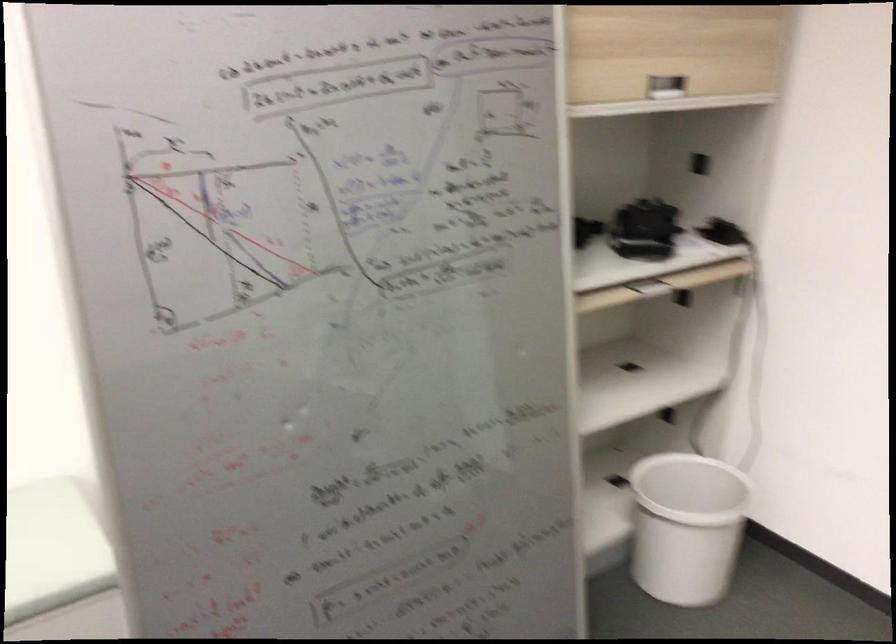
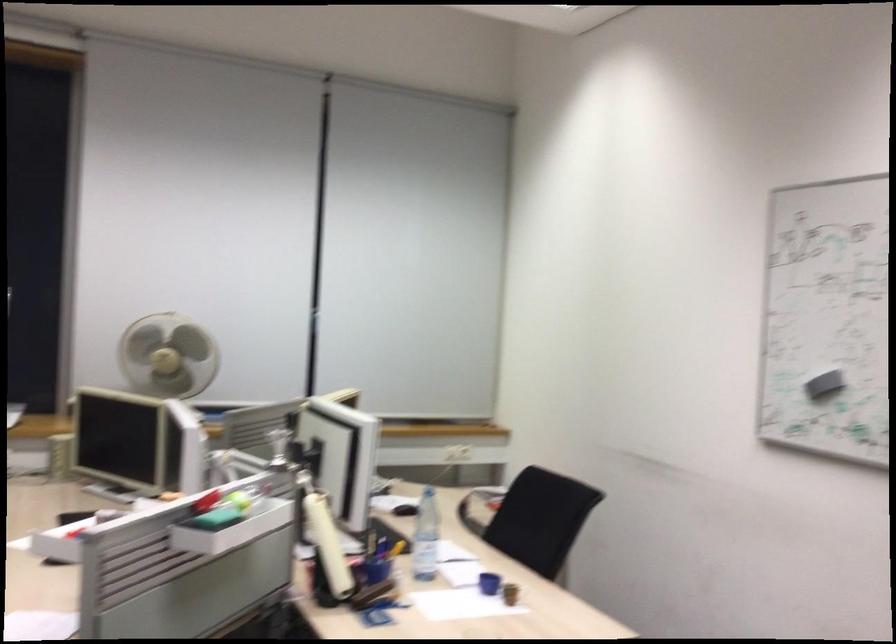
Question: Based on the continuous images, in which direction is the camera rotating? Reply with the corresponding letter.

Choices:
 (A) Left
 (B) Right
 (C) Up
 (D) Down

Answer: (A)